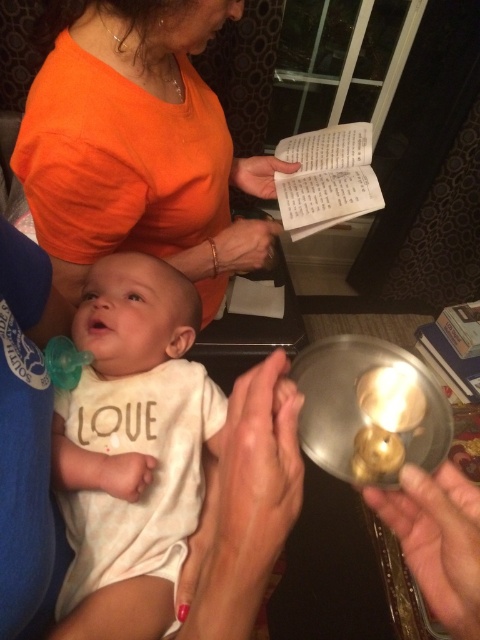
Is point (188, 116) positioned in front of point (240, 621)?

No, (188, 116) is further to viewer.

Is orange cotton shirt at upper left closer to camera compared to smooth skin hand at center?

No, it is behind smooth skin hand at center.

Which is behind, point (74, 140) or point (252, 452)?

The point (74, 140) is more distant.

This screenshot has width=480, height=640. Identify the location of orange cotton shirt at upper left. (128, 140).

Does white soft cotton onesie at center appear on the right side of matte orange shirt at upper center?

Incorrect, white soft cotton onesie at center is not on the right side of matte orange shirt at upper center.

Is point (107, 596) farther from viewer compared to point (237, 228)?

No, it is in front of (237, 228).

I want to click on white soft cotton onesie at center, so click(132, 449).

Does white soft cotton onesie at center appear on the right side of metallic gold ring at lower right?

In fact, white soft cotton onesie at center is to the left of metallic gold ring at lower right.

How distant is white soft cotton onesie at center from metallic gold ring at lower right?

white soft cotton onesie at center is 29.82 centimeters from metallic gold ring at lower right.

Image resolution: width=480 pixels, height=640 pixels. Describe the element at coordinates (132, 449) in the screenshot. I see `white soft cotton onesie at center` at that location.

The width and height of the screenshot is (480, 640). I want to click on white soft cotton onesie at center, so click(x=132, y=449).